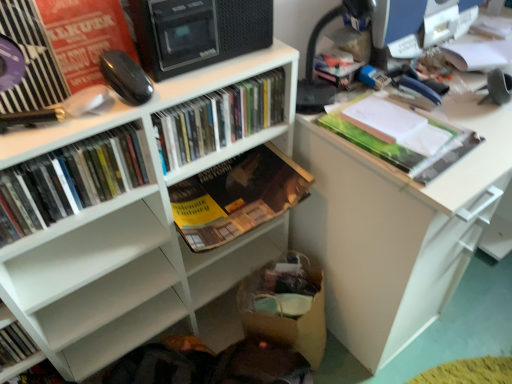
This screenshot has height=384, width=512. What do you see at coordinates (15, 344) in the screenshot? I see `hardcover book at lower left, positioned as the first book in left-to-right order` at bounding box center [15, 344].

The height and width of the screenshot is (384, 512). Describe the element at coordinates (395, 228) in the screenshot. I see `white matte desk at center` at that location.

What do you see at coordinates (409, 27) in the screenshot?
I see `matte black monitor at upper right` at bounding box center [409, 27].

The height and width of the screenshot is (384, 512). Find the location of `matte plastic books at left, the 4th book viewed from the right`. matte plastic books at left, the 4th book viewed from the right is located at coordinates (70, 180).

This screenshot has width=512, height=384. In order to click on hardcover book at lower left, positioned as the first book in left-to-right order in this screenshot , I will do `click(15, 344)`.

How much distance is there between white matte bookcase at upper left and matte black shelf at upper left?

They are 13.77 inches apart.

This screenshot has width=512, height=384. I want to click on bookcase below the matte black shelf at upper left (from a real-world perspective), so click(130, 236).

Does point (188, 93) come farther from viewer compared to point (28, 15)?

Yes, point (188, 93) is farther from viewer.

In the scene shown: Is hardcover book at center, which appears as the 2th book when viewed from the right, positioned far away from matte plastic books at center, placed as the third book when sorted from left to right?

No, hardcover book at center, which appears as the 2th book when viewed from the right, is in close proximity to matte plastic books at center, placed as the third book when sorted from left to right.

Is matte plastic books at center, which is counted as the 3th book, starting from the right, located within hardcover book at center, the 4th book in the left-to-right sequence?

That's incorrect, matte plastic books at center, which is counted as the 3th book, starting from the right, is not inside hardcover book at center, the 4th book in the left-to-right sequence.

Which is less distant, (x=245, y=196) or (x=211, y=121)?

Point (x=245, y=196).

From the image's perspective, between black glossy mouse at upper left and matte plastic books at left, the 4th book viewed from the right, who is located below?

matte plastic books at left, the 4th book viewed from the right, appears lower in the image.

Is black glossy mouse at upper left completely or partially outside of matte plastic books at left, the 4th book viewed from the right?

Indeed, black glossy mouse at upper left is completely outside matte plastic books at left, the 4th book viewed from the right.

How much distance is there between black glossy mouse at upper left and matte plastic books at left, positioned as the second book in left-to-right order?

black glossy mouse at upper left and matte plastic books at left, positioned as the second book in left-to-right order, are 6.46 inches apart from each other.

Does black glossy mouse at upper left touch matte plastic books at left, positioned as the second book in left-to-right order?

black glossy mouse at upper left and matte plastic books at left, positioned as the second book in left-to-right order, are not in contact.

From the picture: From a real-world perspective, is white matte desk at center below green matte folder at upper right, the 5th book viewed from the left?

Yes, from a real-world perspective, white matte desk at center is under green matte folder at upper right, the 5th book viewed from the left.

Does white matte desk at center have a lesser width compared to green matte folder at upper right, the 5th book viewed from the left?

No, white matte desk at center is not thinner than green matte folder at upper right, the 5th book viewed from the left.

Is green matte folder at upper right, the 1th book positioned from the right, located within white matte desk at center?

No, green matte folder at upper right, the 1th book positioned from the right, is located outside of white matte desk at center.

Is white matte desk at center further to camera compared to green matte folder at upper right, the 5th book viewed from the left?

No, white matte desk at center is closer to the viewer.

Which of these two, hardcover book at center, which appears as the 2th book when viewed from the right, or hardcover book at lower left, positioned as the first book in left-to-right order, stands shorter?

hardcover book at lower left, positioned as the first book in left-to-right order, is shorter.

Is hardcover book at center, which appears as the 2th book when viewed from the right, inside the boundaries of hardcover book at lower left, positioned as the first book in left-to-right order, or outside?

hardcover book at center, which appears as the 2th book when viewed from the right, exists outside the volume of hardcover book at lower left, positioned as the first book in left-to-right order.

Is hardcover book at center, the 4th book in the left-to-right sequence, not close to hardcover book at lower left, the 5th book viewed from the right?

They are positioned close to each other.

Is hardcover book at center, the 4th book in the left-to-right sequence, smaller than white matte desk at center?

Yes.

From a real-world perspective, is hardcover book at center, which appears as the 2th book when viewed from the right, above or below white matte desk at center?

Clearly, from a real-world perspective, hardcover book at center, which appears as the 2th book when viewed from the right, is above white matte desk at center.

Between hardcover book at center, the 4th book in the left-to-right sequence, and white matte desk at center, which one is positioned in front?

white matte desk at center is more forward.

Is the surface of hardcover book at center, the 4th book in the left-to-right sequence, in direct contact with white matte desk at center?

No, hardcover book at center, the 4th book in the left-to-right sequence, is not in contact with white matte desk at center.

Is point (98, 221) positioned before point (276, 110)?

No, (98, 221) is behind (276, 110).

From the picture: Which is correct: white matte bookcase at upper left is inside matte plastic books at center, which is counted as the 3th book, starting from the right, or outside of it?

white matte bookcase at upper left is not enclosed by matte plastic books at center, which is counted as the 3th book, starting from the right.

I want to click on the 4th book located above the white matte bookcase at upper left (from a real-world perspective), so [219, 118].

Looking at this image, is white matte bookcase at upper left directly adjacent to matte plastic books at center, placed as the third book when sorted from left to right?

No, white matte bookcase at upper left is not making contact with matte plastic books at center, placed as the third book when sorted from left to right.

Identify the location of shelf above the white matte bookcase at upper left (from a real-world perspective). This screenshot has width=512, height=384. (61, 47).

At what (x,y) coordinates should I click in order to perform the action: click on book that is the 3rd one below the matte plastic books at center, which is counted as the 3th book, starting from the right (from a real-world perspective). Please return your answer as a coordinate pair (x, y). This screenshot has width=512, height=384. Looking at the image, I should click on (236, 196).

When comparing their distances from matte plastic books at center, placed as the third book when sorted from left to right, does black plastic radio at upper center or hardcover book at center, the 4th book in the left-to-right sequence, seem further?

hardcover book at center, the 4th book in the left-to-right sequence, is further to matte plastic books at center, placed as the third book when sorted from left to right.

From the image, which object appears to be nearer to white matte desk at center, hardcover book at lower left, the 5th book viewed from the right, or black glossy mouse at upper left?

Based on the image, black glossy mouse at upper left appears to be nearer to white matte desk at center.

Based on their spatial positions, is matte black shelf at upper left or white matte bookcase at upper left further from black glossy mouse at upper left?

The object further to black glossy mouse at upper left is white matte bookcase at upper left.

Which object lies nearer to the anchor point matte black shelf at upper left, black glossy mouse at upper left or white matte desk at center?

black glossy mouse at upper left.

Estimate the real-world distances between objects in this image. Which object is further from black plastic radio at upper center, matte black monitor at upper right or hardcover book at lower left, positioned as the first book in left-to-right order?

hardcover book at lower left, positioned as the first book in left-to-right order, is positioned further to the anchor black plastic radio at upper center.

Looking at the image, which one is located further to white matte bookcase at upper left, black glossy mouse at upper left or hardcover book at center, which appears as the 2th book when viewed from the right?

black glossy mouse at upper left.

Looking at this image, based on their spatial positions, is matte black shelf at upper left or black glossy mouse at upper left further from green matte folder at upper right, the 5th book viewed from the left?

matte black shelf at upper left is positioned further to the anchor green matte folder at upper right, the 5th book viewed from the left.

From the picture: Based on their spatial positions, is hardcover book at center, the 4th book in the left-to-right sequence, or matte plastic books at left, positioned as the second book in left-to-right order, closer to matte black monitor at upper right?

hardcover book at center, the 4th book in the left-to-right sequence, lies closer to matte black monitor at upper right than the other object.

Locate an element on the screen. The height and width of the screenshot is (384, 512). equipment between matte plastic books at left, positioned as the second book in left-to-right order, and matte plastic books at center, which is counted as the 3th book, starting from the right, from left to right is located at coordinates (125, 77).

Where is `book between black plastic radio at upper center and green matte folder at upper right, the 1th book positioned from the right, in the horizontal direction`? The height and width of the screenshot is (384, 512). book between black plastic radio at upper center and green matte folder at upper right, the 1th book positioned from the right, in the horizontal direction is located at coordinates (236, 196).

Locate an element on the screen. This screenshot has height=384, width=512. equipment between hardcover book at lower left, the 5th book viewed from the right, and green matte folder at upper right, the 1th book positioned from the right is located at coordinates (125, 77).

Find the location of a particular element. This screenshot has height=384, width=512. computer tower between black glossy mouse at upper left and white matte desk at center from left to right is located at coordinates (x=197, y=32).